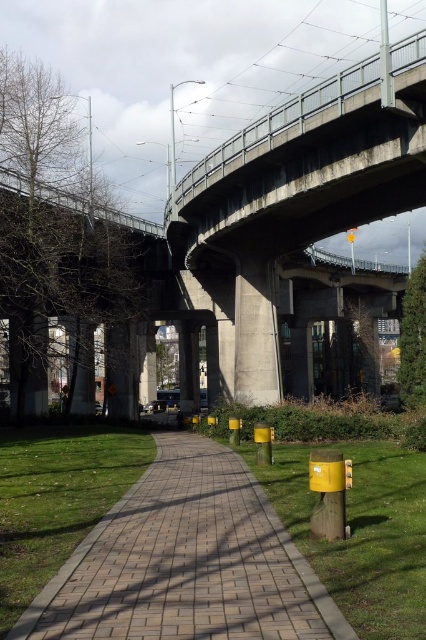
Between brick paved walkway at center and metallic gray pole at upper right, which one is positioned lower?

brick paved walkway at center is below.

Which is in front, point (172, 499) or point (379, 10)?

Point (172, 499)

Locate an element on the screen. The width and height of the screenshot is (426, 640). brick paved walkway at center is located at coordinates (186, 561).